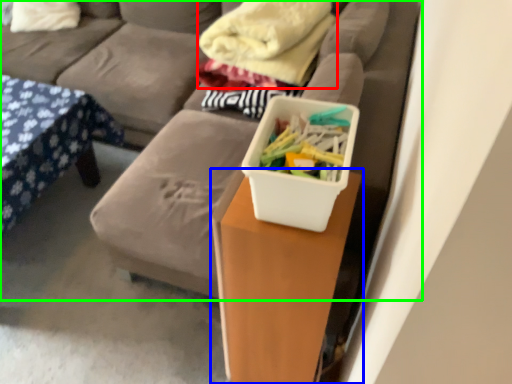
Question: Which object is the farthest from blanket (highlighted by a red box)? Choose among these: table (highlighted by a blue box) or studio couch (highlighted by a green box).

Choices:
 (A) table
 (B) studio couch

Answer: (A)